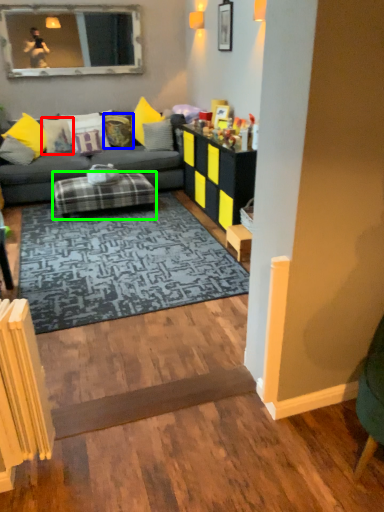
Question: Which is nearer to the pillow (highlighted by a red box)? pillow (highlighted by a blue box) or table (highlighted by a green box).

Choices:
 (A) pillow
 (B) table

Answer: (A)